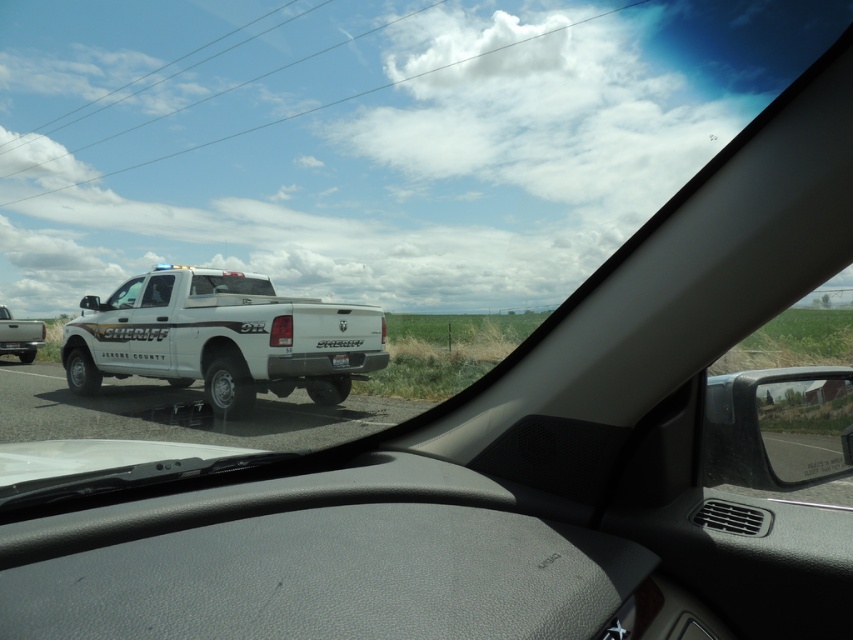
Question: From the image, what is the correct spatial relationship of white matte sheriff truck at center in relation to clear glass windshield at center?

Choices:
 (A) below
 (B) above

Answer: (A)

Question: Estimate the real-world distances between objects in this image. Which object is closer to the white matte license plate at center?

Choices:
 (A) clear glass windshield at center
 (B) white matte sheriff truck at center

Answer: (B)

Question: Can you confirm if white matte sheriff truck at center is positioned to the right of white matte pickup truck at left?

Choices:
 (A) yes
 (B) no

Answer: (A)

Question: Is white matte sheriff truck at center wider than white matte license plate at center?

Choices:
 (A) yes
 (B) no

Answer: (A)

Question: Among these objects, which one is farthest from the camera?

Choices:
 (A) clear glass windshield at center
 (B) white matte pickup truck at left
 (C) white matte sheriff truck at center

Answer: (B)

Question: Estimate the real-world distances between objects in this image. Which object is farther from the clear glass windshield at center?

Choices:
 (A) white matte pickup truck at left
 (B) white matte license plate at center

Answer: (A)